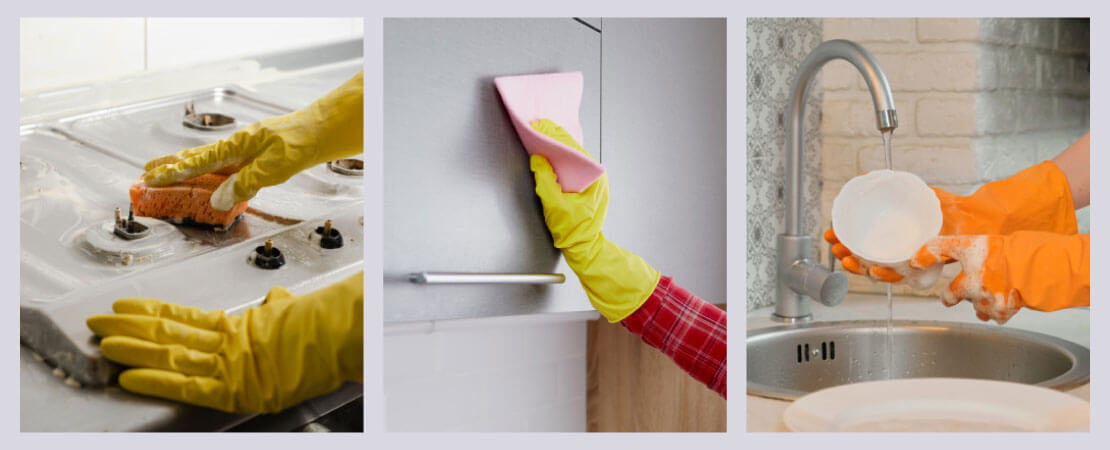
Image resolution: width=1110 pixels, height=450 pixels. I want to click on left range top, so click(85, 181).